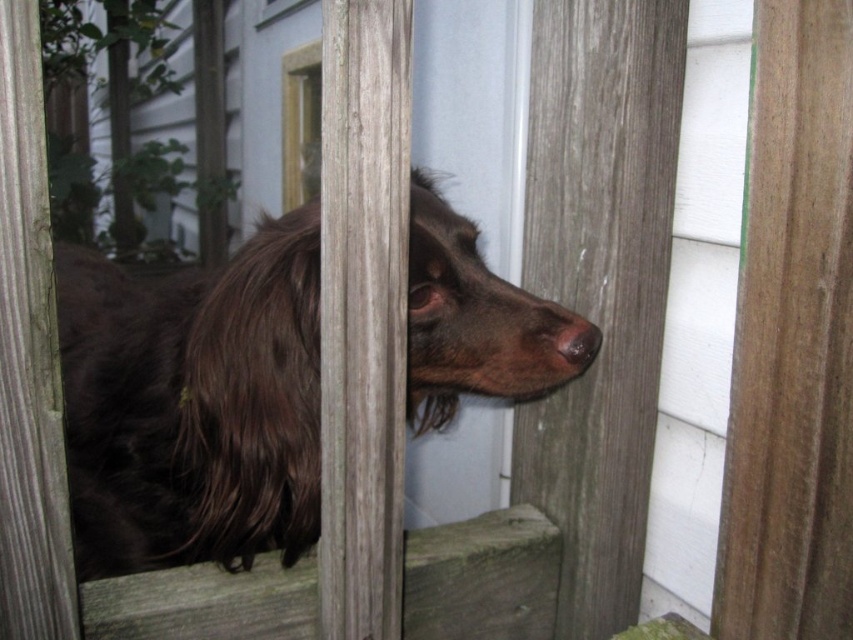
Who is higher up, shiny brown fur at center or brown matte nose at center?

brown matte nose at center is higher up.

Looking at this image, is shiny brown fur at center wider than brown matte nose at center?

Yes, shiny brown fur at center is wider than brown matte nose at center.

Between point (115, 349) and point (575, 323), which one is positioned in front?

Point (575, 323)

At what (x,y) coordinates should I click in order to perform the action: click on shiny brown fur at center. Please return your answer as a coordinate pair (x, y). The height and width of the screenshot is (640, 853). Looking at the image, I should click on (193, 403).